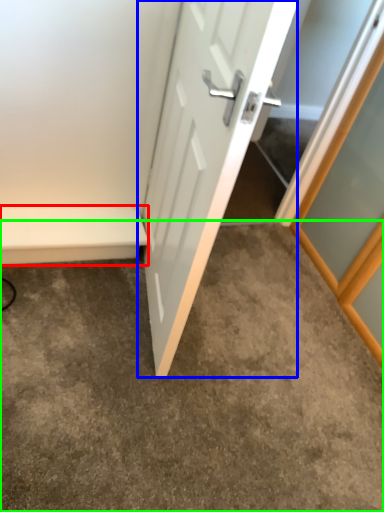
Question: Which object is the closest to the balustrade (highlighted by a red box)? Choose among these: door (highlighted by a blue box) or concrete (highlighted by a green box).

Choices:
 (A) door
 (B) concrete

Answer: (B)